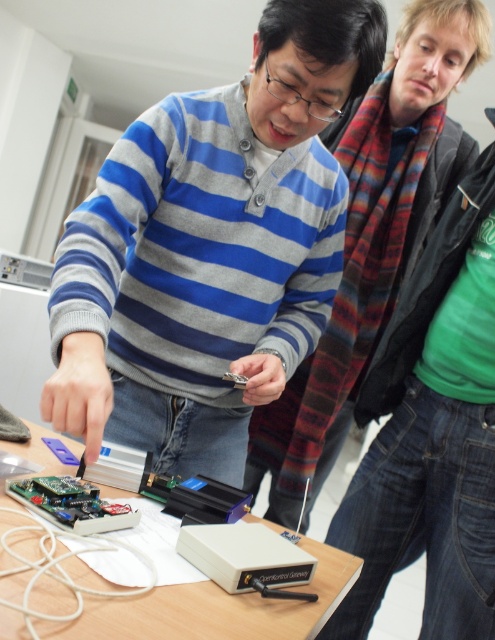
Question: Which of these objects is positioned farthest from the striped sweater at center?

Choices:
 (A) gray striped sweater at center
 (B) wooden table at center
 (C) green circuit board at lower left

Answer: (C)

Question: Considering the relative positions of wooden table at center and green circuit board at lower left in the image provided, where is wooden table at center located with respect to green circuit board at lower left?

Choices:
 (A) left
 (B) right

Answer: (B)

Question: Can you confirm if gray striped sweater at center is positioned to the left of wooden table at center?

Choices:
 (A) yes
 (B) no

Answer: (B)

Question: Is gray striped sweater at center above green circuit board at lower left?

Choices:
 (A) yes
 (B) no

Answer: (A)

Question: Which point is closer to the camera?

Choices:
 (A) (475, 52)
 (B) (75, 502)

Answer: (B)

Question: Which object is the closest to the striped sweater at center?

Choices:
 (A) wooden table at center
 (B) gray striped sweater at center

Answer: (B)